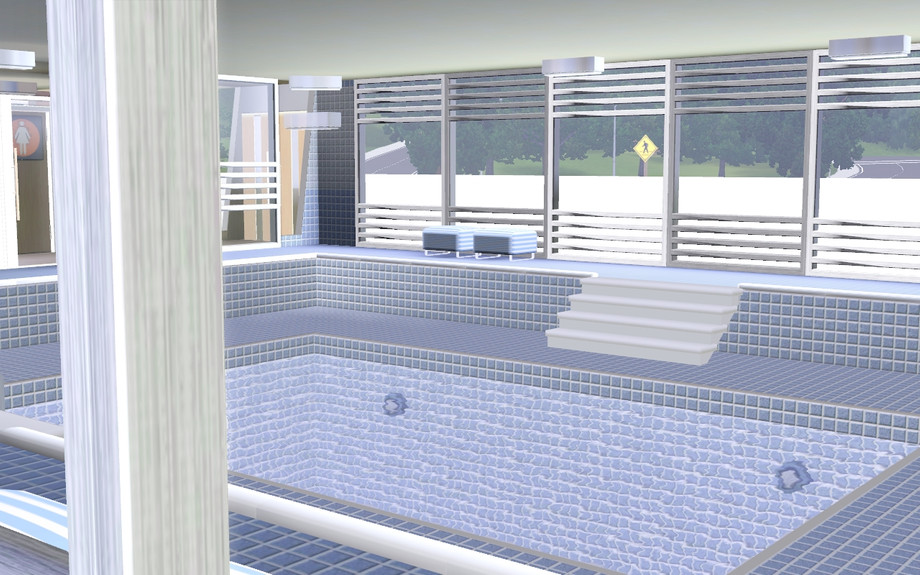
At what (x,y) coordinates should I click in order to perform the action: click on windows. Please return your answer as a coordinate pair (x, y). The height and width of the screenshot is (575, 920). Looking at the image, I should click on (393, 162), (496, 164), (593, 158), (718, 180), (868, 191).